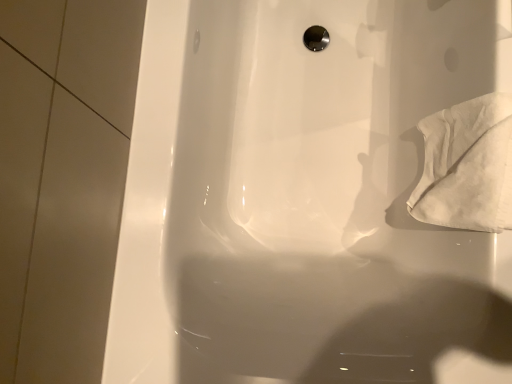
Describe the element at coordinates (467, 166) in the screenshot. I see `white cotton towel at right` at that location.

Find the location of a particular element. Image resolution: width=512 pixels, height=384 pixels. white cotton towel at right is located at coordinates (467, 166).

Identify the location of white cotton towel at right. The image size is (512, 384). (467, 166).